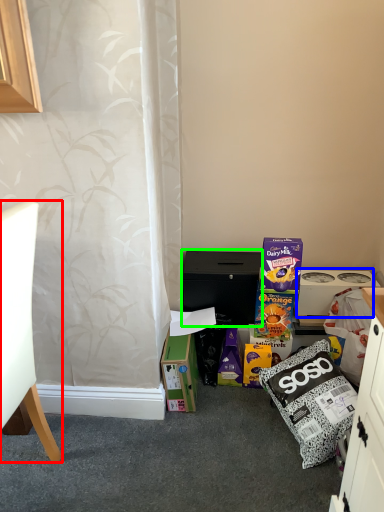
Question: Which object is positioned farthest from chair (highlighted by a red box)? Select from appliance (highlighted by a blue box) and cabinetry (highlighted by a green box).

Choices:
 (A) appliance
 (B) cabinetry

Answer: (A)